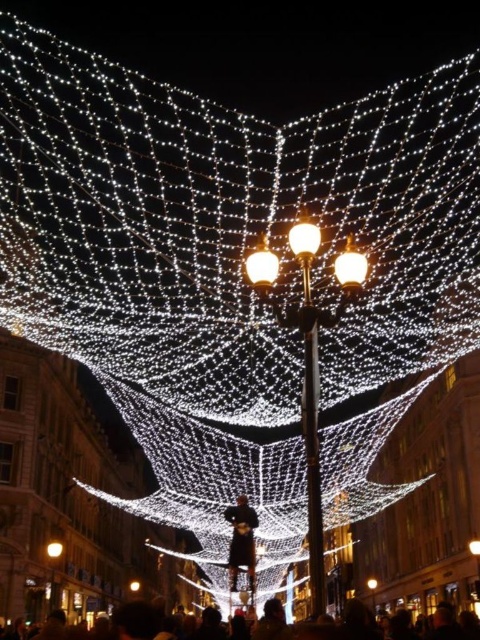
You are a city planner reviewing the layout of this festive area. You need to ensure that the matte gold streetlight at center is visible to pedestrians walking underneath the illuminated wire mesh at center. Based on their positions, is the streetlight likely to be obscured by the mesh?

The matte gold streetlight at center is located below the illuminated wire mesh at center, so it is positioned beneath the mesh. This means the wire mesh could potentially block the view of the streetlight from above, making it less visible to pedestrians walking underneath the mesh.

You are standing at the point with coordinates point (303, 237) in the festive nighttime scene. What object are you standing on?

The point (303, 237) corresponds to the matte glass streetlight at center, so you are standing on the matte glass streetlight at center.

You are a city planner assessing the width of two central structures in the festive scene. The structures are the matte glass streetlight at center and the illuminated wire mesh at center. Which structure is wider?

The matte glass streetlight at center is wider than the illuminated wire mesh at center.